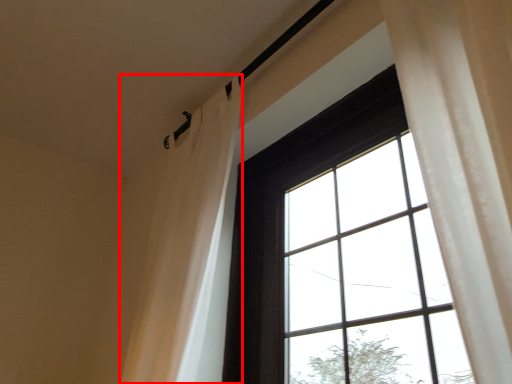
Question: Observing the image, what is the correct spatial positioning of shower curtain (annotated by the red box) in reference to window?

Choices:
 (A) left
 (B) right

Answer: (A)